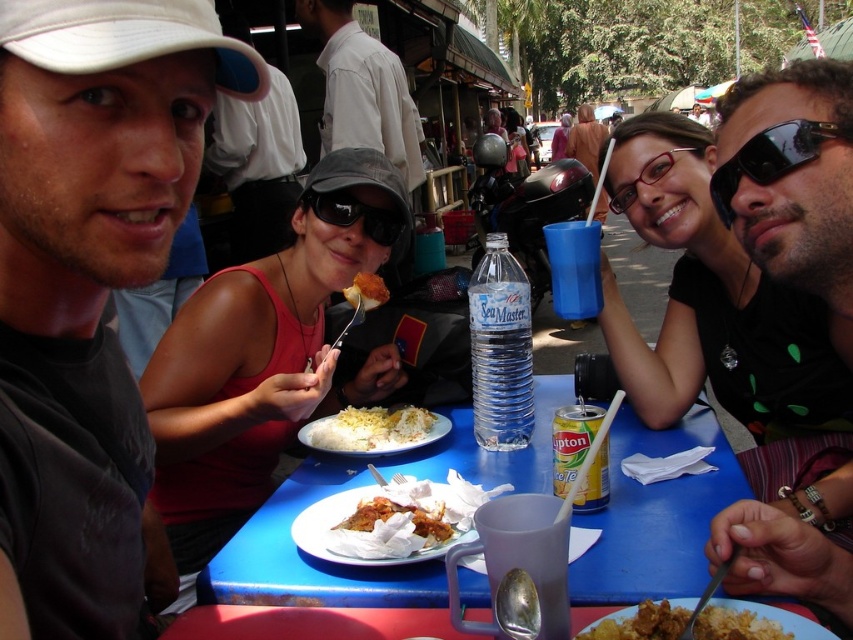
You are a photographer trying to capture a clear shot of both the matte black shirt at left and the black plastic sunglasses at upper right. Since you want both subjects to be in focus, you need to adjust your camera settings based on their heights. Which object is taller?

The matte black shirt at left is much taller than the black plastic sunglasses at upper right, so you should focus on the matte black shirt at left to ensure both are in focus.

You are a customer at the outdoor dining area. You see a point at coordinate (90, 259). What object is located at that point?

The point at coordinate (90, 259) is on the matte black shirt at left.

You are a food critic visiting this tropical eatery. You notice two dishes at the center of the table. Which one is bigger in size between the white matte rice at center and the golden crispy pastry at center?

The white matte rice at center is larger in size than the golden crispy pastry at center.